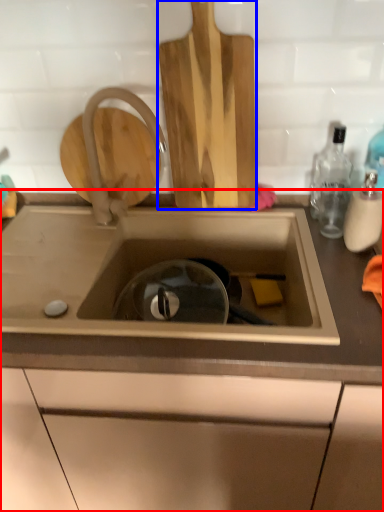
Question: Which point is closer to the camera, countertop (highlighted by a red box) or cutting board (highlighted by a blue box)?

Choices:
 (A) countertop
 (B) cutting board

Answer: (A)